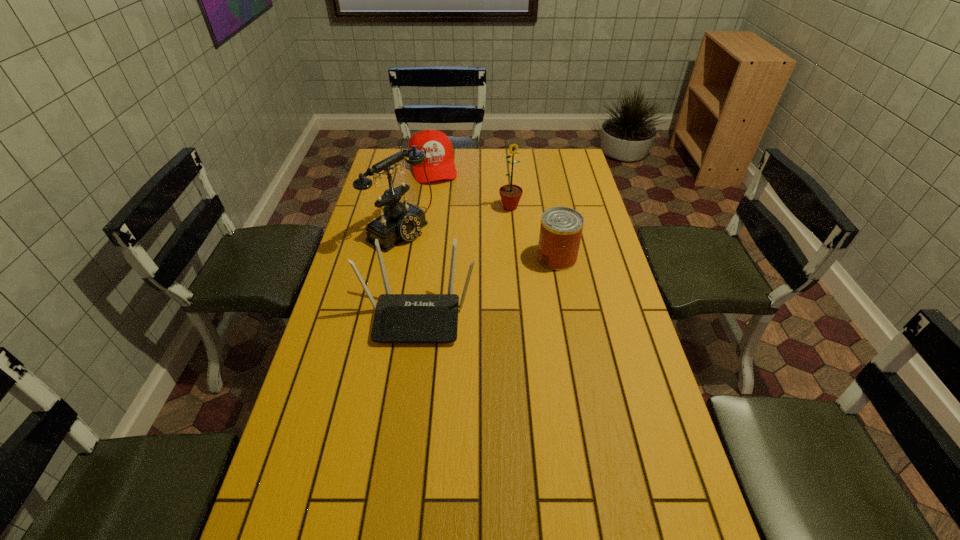
Image resolution: width=960 pixels, height=540 pixels. In order to click on vacant area located on the face of the fourth object from left to right in this screenshot , I will do `click(509, 284)`.

This screenshot has width=960, height=540. I want to click on free spot located on the front panel of the farthest object, so click(451, 232).

At what (x,y) coordinates should I click in order to perform the action: click on free spot located on the front panel of the farthest object. Please return your answer as a coordinate pair (x, y). The image size is (960, 540). Looking at the image, I should click on (445, 214).

What are the coordinates of `free space located on the front panel of the farthest object` in the screenshot? It's located at (454, 240).

Image resolution: width=960 pixels, height=540 pixels. I want to click on vacant space located on the dial of the telephone, so click(x=444, y=256).

You are a GUI agent. You are given a task and a screenshot of the screen. Output one action in this format:
    pyautogui.click(x=<x>, y=<y>)
    Task: Click on the blank area located on the dial of the telephone
    This screenshot has height=540, width=960.
    Given the screenshot: What is the action you would take?
    click(x=469, y=271)

The height and width of the screenshot is (540, 960). What are the coordinates of `free space located on the dial of the telephone` in the screenshot? It's located at (468, 269).

Identify the location of object that is at the far edge. (439, 164).

At what (x,y) coordinates should I click in order to perform the action: click on router located in the left edge section of the desktop. Please return your answer as a coordinate pair (x, y). Looking at the image, I should click on (398, 317).

Identify the location of baseball cap that is at the left edge. The height and width of the screenshot is (540, 960). (439, 164).